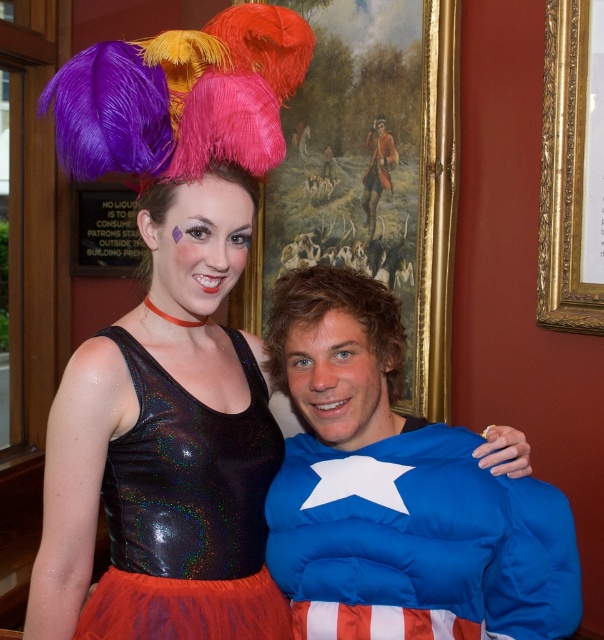
Does blue padded costume at center have a larger size compared to holographic sequin leotard at center?

Indeed, blue padded costume at center has a larger size compared to holographic sequin leotard at center.

Between blue padded costume at center and holographic sequin leotard at center, which one is positioned higher?

Positioned higher is holographic sequin leotard at center.

Is point (390, 605) farther from viewer compared to point (130, 467)?

No.

Identify the location of blue padded costume at center. (397, 490).